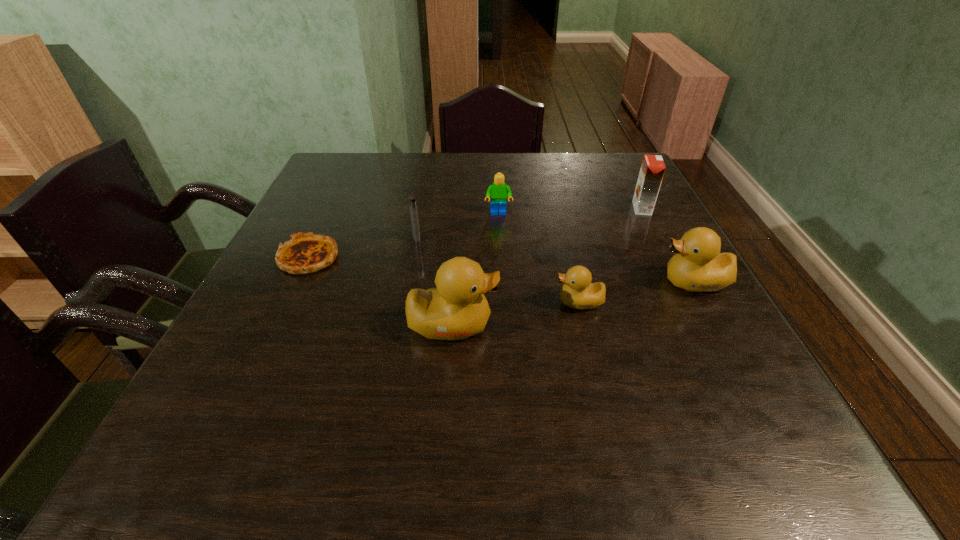
Please point out where to position a new duckling on the left to maintain spacing. Please provide its 2D coordinates. Your answer should be formatted as a tuple, i.e. [(x, y)], where the tuple contains the x and y coordinates of a point satisfying the conditions above.

[(312, 349)]